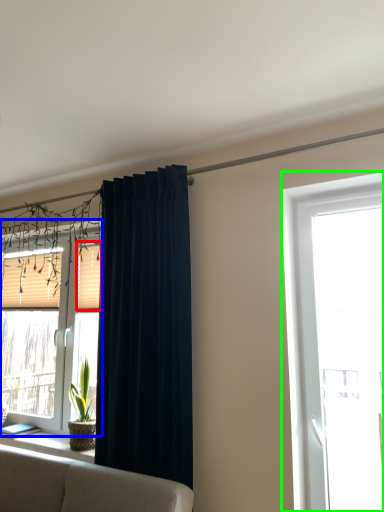
Question: Which object is the closest to the shutter (highlighted by a red box)? Choose among these: window (highlighted by a blue box) or window (highlighted by a green box).

Choices:
 (A) window
 (B) window

Answer: (A)